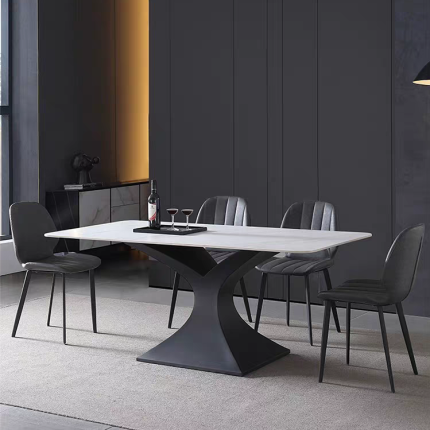
Find the location of a particular element. light glow is located at coordinates (143, 95).